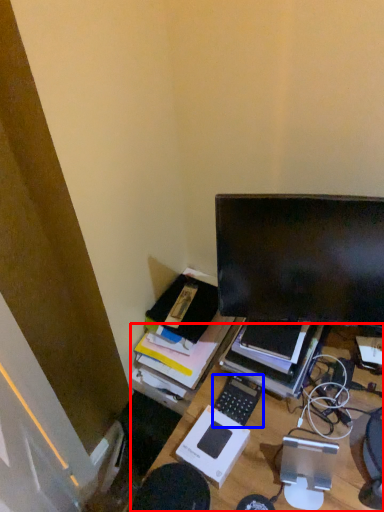
Question: Which object is closer to the camera taking this photo, desk (highlighted by a red box) or computer keyboard (highlighted by a blue box)?

Choices:
 (A) desk
 (B) computer keyboard

Answer: (A)